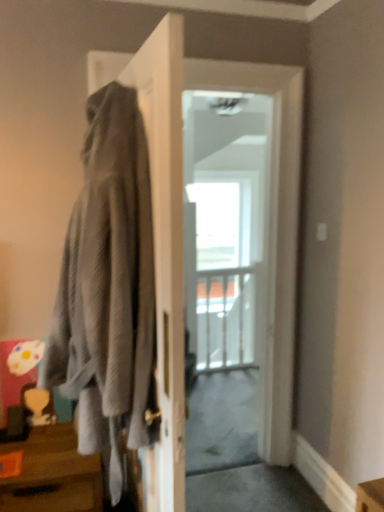
Where is `empty space that is ontop of white glossy door at center (from a real-world perspective)`? This screenshot has height=512, width=384. empty space that is ontop of white glossy door at center (from a real-world perspective) is located at coordinates (233, 54).